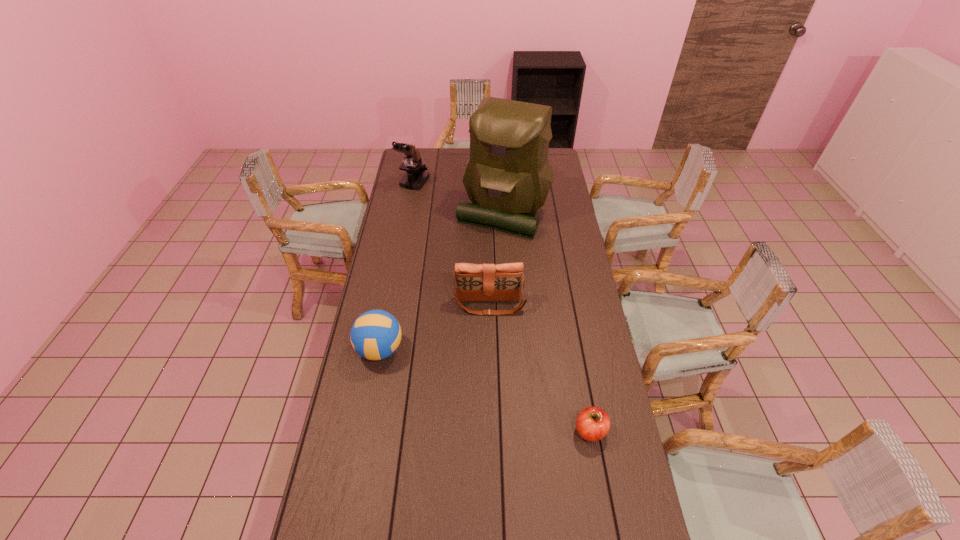
At what (x,y) coordinates should I click in order to perform the action: click on free space that satisfies the following two spatial constraints: 1. on the front-facing side of the shoulder bag; 2. on the right side of the nearest object. Please return your answer as a coordinate pair (x, y). Looking at the image, I should click on (492, 431).